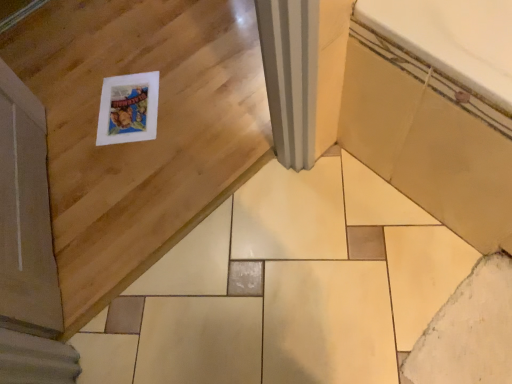
I want to click on free spot above white matte ceramic tile at lower right (from a real-world perspective), so click(475, 337).